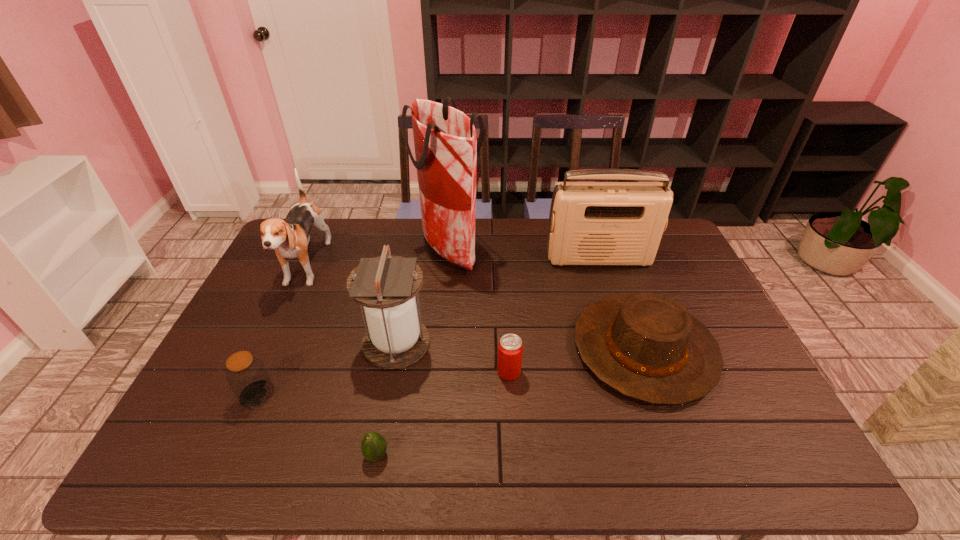
Locate an element on the screen. grocery bag is located at coordinates (446, 145).

Where is `radio receiver`? radio receiver is located at coordinates (591, 223).

The height and width of the screenshot is (540, 960). What are the coordinates of `puppy` in the screenshot? It's located at (290, 238).

The width and height of the screenshot is (960, 540). What are the coordinates of `lantern` in the screenshot? It's located at (386, 286).

Locate an element on the screen. This screenshot has width=960, height=540. cowboy hat is located at coordinates (646, 346).

You are a GUI agent. You are given a task and a screenshot of the screen. Output one action in this format:
    pyautogui.click(x=<x>, y=<y>)
    Task: Click on the jar
    
    Given the screenshot: What is the action you would take?
    pyautogui.click(x=246, y=374)

Find the location of a particular element. This screenshot has width=960, height=540. the third object from right to left is located at coordinates coord(510,347).

This screenshot has width=960, height=540. I want to click on the shortest object, so click(373, 446).

Where is `avocado`? This screenshot has height=540, width=960. avocado is located at coordinates (373, 446).

Identify the location of vacant space situated on the left of the tallest object. This screenshot has height=540, width=960. (334, 250).